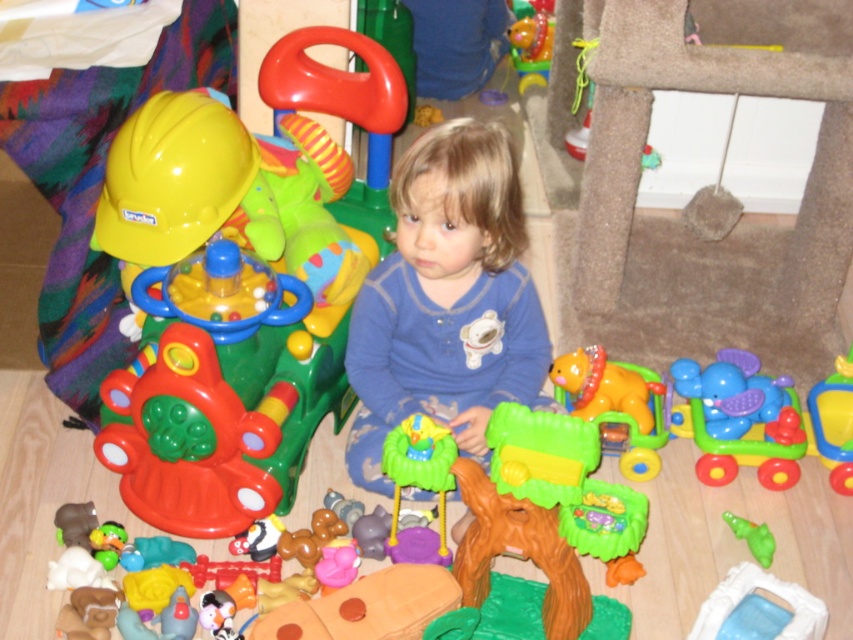
Question: Where is matte plastic construction helmet at left located in relation to shiny yellow plastic toy car at lower center in the image?

Choices:
 (A) left
 (B) right

Answer: (A)

Question: Is matte plastic construction helmet at left positioned before translucent plastic toy at lower right?

Choices:
 (A) no
 (B) yes

Answer: (A)

Question: Does rubber duck at center have a larger size compared to green rubber duck at lower right?

Choices:
 (A) yes
 (B) no

Answer: (A)

Question: Which of these objects is positioned farthest from the translucent plastic toy at lower right?

Choices:
 (A) rubberized red and green toy at center
 (B) rubber duck at center

Answer: (A)

Question: Which object is closer to the camera taking this photo?

Choices:
 (A) rubberized yellow toy at center
 (B) matte plastic construction helmet at left

Answer: (B)

Question: Estimate the real-world distances between objects in this image. Which object is closer to the translucent plastic swing at center?

Choices:
 (A) matte plastic construction helmet at left
 (B) rubber duck at center
 (C) rubberized yellow toy at center

Answer: (A)